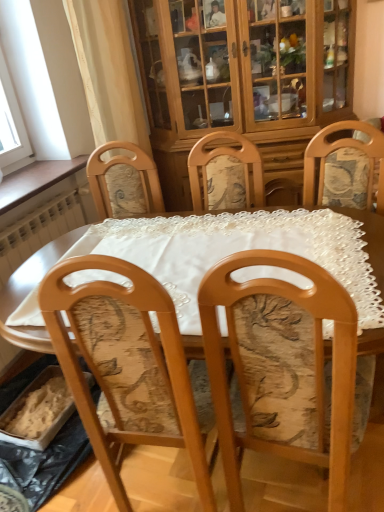
Question: Considering the relative sizes of wooden cabinet at upper center and wooden table at center in the image provided, is wooden cabinet at upper center shorter than wooden table at center?

Choices:
 (A) yes
 (B) no

Answer: (B)

Question: Is wooden cabinet at upper center not close to wooden table at center?

Choices:
 (A) no
 (B) yes

Answer: (B)

Question: From the image's perspective, does wooden cabinet at upper center appear lower than wooden table at center?

Choices:
 (A) yes
 (B) no

Answer: (B)

Question: Is wooden cabinet at upper center touching wooden table at center?

Choices:
 (A) yes
 (B) no

Answer: (B)

Question: Does wooden cabinet at upper center have a larger size compared to wooden table at center?

Choices:
 (A) yes
 (B) no

Answer: (A)

Question: Is wooden chair with floral upholstery at center inside the boundaries of wooden table at center, or outside?

Choices:
 (A) inside
 (B) outside

Answer: (A)

Question: Based on their positions, is wooden chair with floral upholstery at center located to the left or right of wooden table at center?

Choices:
 (A) left
 (B) right

Answer: (B)

Question: From a real-world perspective, relative to wooden table at center, is wooden chair with floral upholstery at center vertically above or below?

Choices:
 (A) below
 (B) above

Answer: (B)

Question: From the image's perspective, relative to wooden table at center, is wooden chair with floral upholstery at center above or below?

Choices:
 (A) below
 (B) above

Answer: (A)

Question: Looking at their shapes, would you say wooden cabinet at upper center is wider or thinner than wooden table at center?

Choices:
 (A) thin
 (B) wide

Answer: (A)

Question: Considering the positions of wooden cabinet at upper center and wooden table at center in the image, is wooden cabinet at upper center bigger or smaller than wooden table at center?

Choices:
 (A) small
 (B) big

Answer: (B)

Question: Visually, is wooden cabinet at upper center positioned to the left or to the right of wooden table at center?

Choices:
 (A) left
 (B) right

Answer: (B)

Question: Is point (170, 172) positioned closer to the camera than point (374, 402)?

Choices:
 (A) closer
 (B) farther

Answer: (B)

Question: Is wooden chair with floral upholstery at center inside or outside of wooden cabinet at upper center?

Choices:
 (A) outside
 (B) inside

Answer: (A)

Question: In the image, is wooden chair with floral upholstery at center on the left side or the right side of wooden cabinet at upper center?

Choices:
 (A) right
 (B) left

Answer: (B)